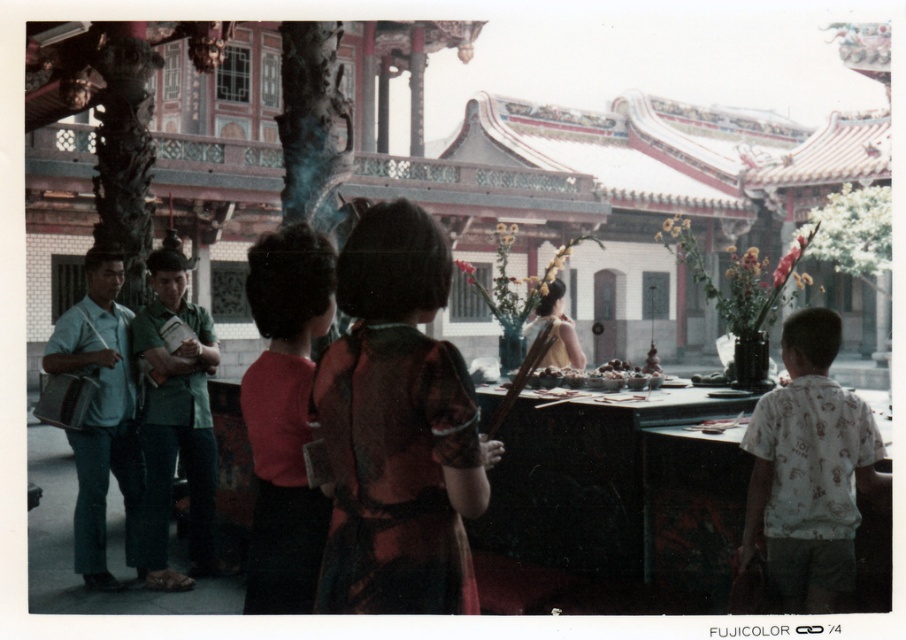
Question: Estimate the real-world distances between objects in this image. Which object is closer to the matte brown dress at center?

Choices:
 (A) red matte shirt at center
 (B) matte gold hairpin at center
 (C) matte green shirt at left
 (D) green fabric shirt at center

Answer: (A)

Question: Is white printed shirt at right to the left of red matte shirt at center from the viewer's perspective?

Choices:
 (A) yes
 (B) no

Answer: (B)

Question: Which point appears closest to the camera in this image?

Choices:
 (A) (788, 520)
 (B) (359, 275)
 (C) (551, 284)
 (D) (315, 289)

Answer: (B)

Question: Does red matte shirt at center come behind green fabric shirt at center?

Choices:
 (A) yes
 (B) no

Answer: (B)

Question: Which point is closer to the camera?

Choices:
 (A) green fabric shirt at center
 (B) matte brown dress at center

Answer: (B)

Question: Does white printed shirt at right come behind matte green shirt at left?

Choices:
 (A) yes
 (B) no

Answer: (B)